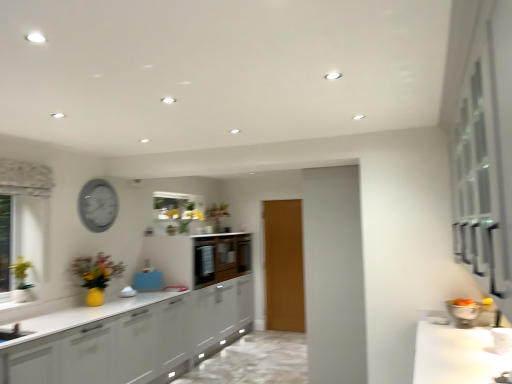
Question: Do you think yellow matte floral arrangement at center, arranged as the first floral arrangement when viewed from the back, is within matte gray clock at upper left, or outside of it?

Choices:
 (A) outside
 (B) inside

Answer: (A)

Question: In the image, is yellow matte floral arrangement at center, acting as the 1th floral arrangement starting from the right, positioned in front of or behind matte gray clock at upper left?

Choices:
 (A) front
 (B) behind

Answer: (B)

Question: Based on their relative distances, which object is nearer to the matte white vase at left, which appears as the second floral arrangement when viewed from the top?

Choices:
 (A) matte brown cabinetry at center
 (B) white glossy countertop at lower right
 (C) wooden door at center
 (D) matte gray clock at upper left
 (E) yellow matte vase at left

Answer: (E)

Question: Considering the real-world distances, which object is farthest from the matte white vase at left, the second floral arrangement in the right-to-left sequence?

Choices:
 (A) yellow matte vase at left
 (B) matte brown cabinetry at center
 (C) matte gray clock at upper left
 (D) yellow matte floral arrangement at center, the 2th floral arrangement positioned from the front
 (E) wooden door at center

Answer: (E)